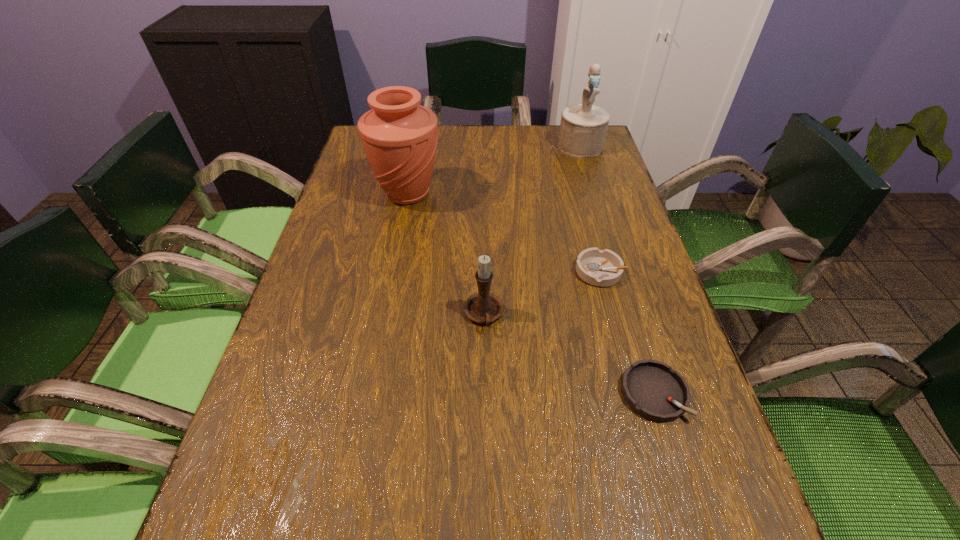
Where is `vacant area that lies between the candle holder and the leftmost object`? Image resolution: width=960 pixels, height=540 pixels. vacant area that lies between the candle holder and the leftmost object is located at coordinates (445, 254).

I want to click on empty location between the third nearest object and the leftmost object, so coord(504,233).

Locate an element on the screen. free space between the second object from left to right and the figurine is located at coordinates (532, 231).

Find the location of a particular element. This screenshot has height=540, width=960. vacant space in between the third nearest object and the nearest object is located at coordinates (627, 332).

Locate an element on the screen. The width and height of the screenshot is (960, 540). vacant point located between the figurine and the candle holder is located at coordinates (532, 231).

What are the coordinates of `free spot between the second nearest object and the figurine` in the screenshot? It's located at (532, 231).

The image size is (960, 540). In order to click on free space between the nearest object and the farther ashtray in this screenshot , I will do `click(627, 332)`.

The height and width of the screenshot is (540, 960). I want to click on free point between the nearer ashtray and the vase, so click(531, 293).

Select which object appears as the third closest to the figurine. Please provide its 2D coordinates. Your answer should be formatted as a tuple, i.e. [(x, y)], where the tuple contains the x and y coordinates of a point satisfying the conditions above.

[(483, 307)]

You are a GUI agent. You are given a task and a screenshot of the screen. Output one action in this format:
    pyautogui.click(x=<x>, y=<y>)
    Task: Click on the object that is the fourth nearest to the vase
    Image resolution: width=960 pixels, height=540 pixels.
    Given the screenshot: What is the action you would take?
    pyautogui.click(x=652, y=389)